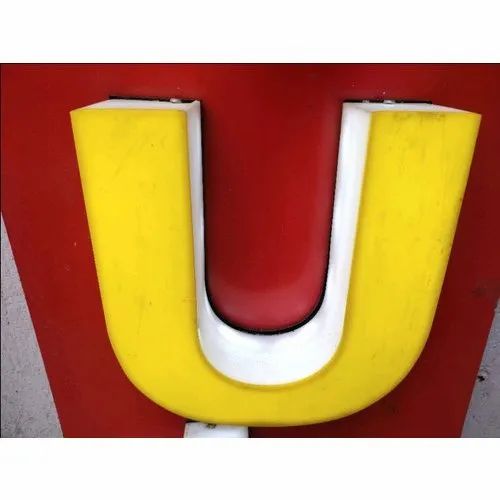
Image resolution: width=500 pixels, height=500 pixels. Identify the location of electronic device. (229, 429).